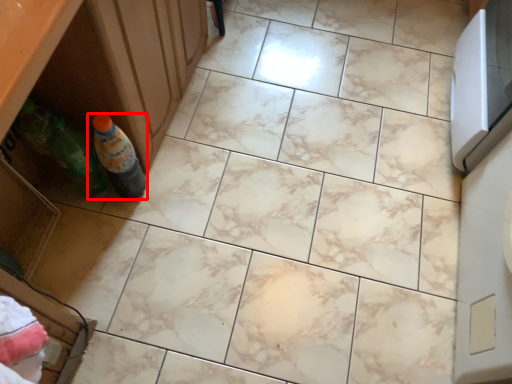
Question: Where is bottle (annotated by the red box) located in relation to drawer in the image?

Choices:
 (A) left
 (B) right

Answer: (B)